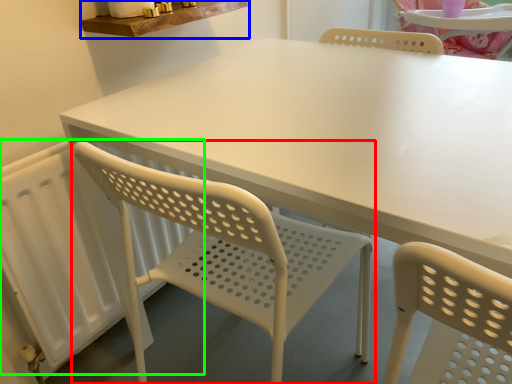
Question: Estimate the real-world distances between objects in this image. Which object is farther from chair (highlighted by a red box), counter top (highlighted by a blue box) or radiator (highlighted by a green box)?

Choices:
 (A) counter top
 (B) radiator

Answer: (A)